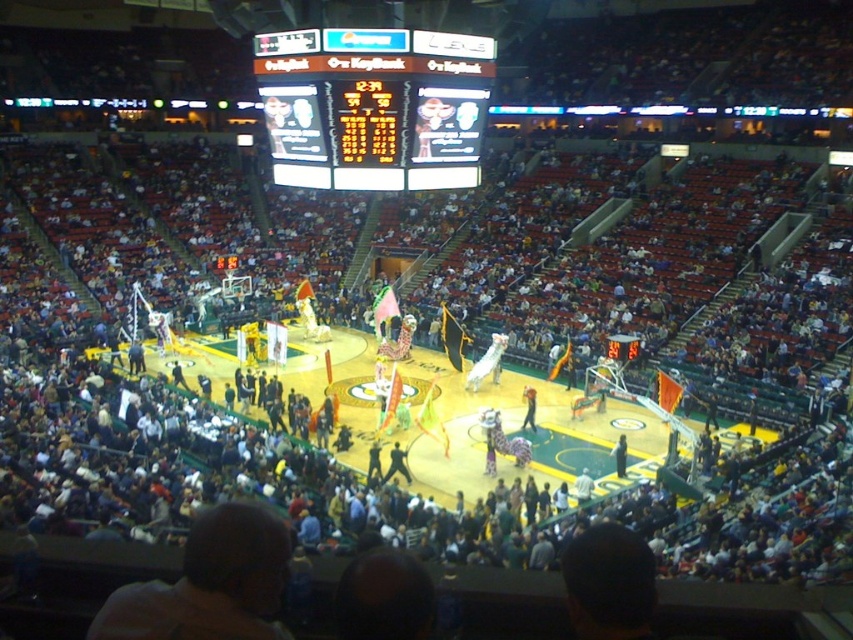
Does white plastic scoreboard at upper center have a lesser width compared to metallic scoreboard at center?

No, white plastic scoreboard at upper center is not thinner than metallic scoreboard at center.

Which is in front, point (263, 93) or point (614, 342)?

Point (263, 93)

Who is more distant from viewer, (373, 29) or (619, 337)?

Point (619, 337)

The image size is (853, 640). I want to click on white plastic scoreboard at upper center, so click(x=374, y=106).